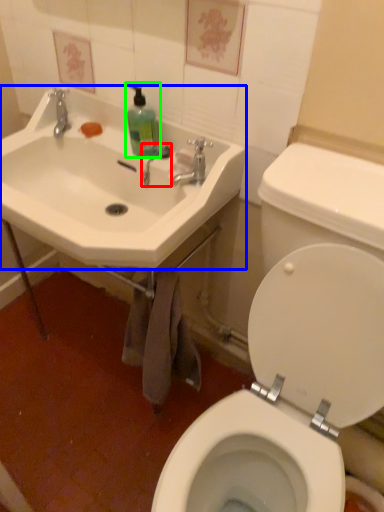
Question: Which is farther away from plumbing fixture (highlighted by a red box)? sink (highlighted by a blue box) or cleaning product (highlighted by a green box)?

Choices:
 (A) sink
 (B) cleaning product

Answer: (A)